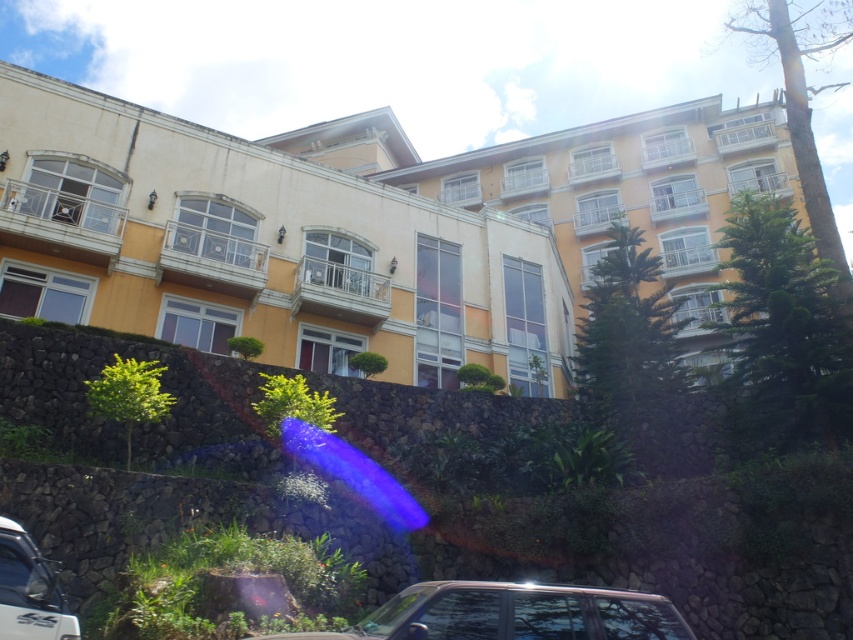
You are standing in front of the building and want to place a small garden statue exactly at the center of the green leafy shrubs at lower center. According to the image, what are the coordinates where you should place the statue?

The coordinates for the center of the green leafy shrubs at lower center are at point [418,493], so you should place the statue there.

You are a delivery person trying to park your white glossy car at lower left near the yellow matte building at center. Considering their sizes, will the car fit in the parking space right next to the building?

The yellow matte building at center is much taller than the white glossy car at lower left, but height difference doesn not determine parking space width. You need to check the parking space dimensions instead of comparing their heights.

You are a landscape architect designing a garden around the yellow matte building at center and the green leafy shrubs at lower center. If you want to plant a new row of flowers between them, which side of the shrubs should you place them on to ensure they are closer to the building?

The flowers should be planted on the side of the green leafy shrubs at lower center that faces the yellow matte building at center since the shrubs are closer to the building than the flowers would need to be.